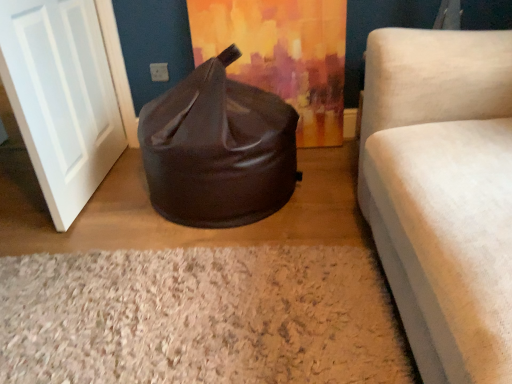
The height and width of the screenshot is (384, 512). I want to click on vacant space in white matte door at left (from a real-world perspective), so click(x=96, y=187).